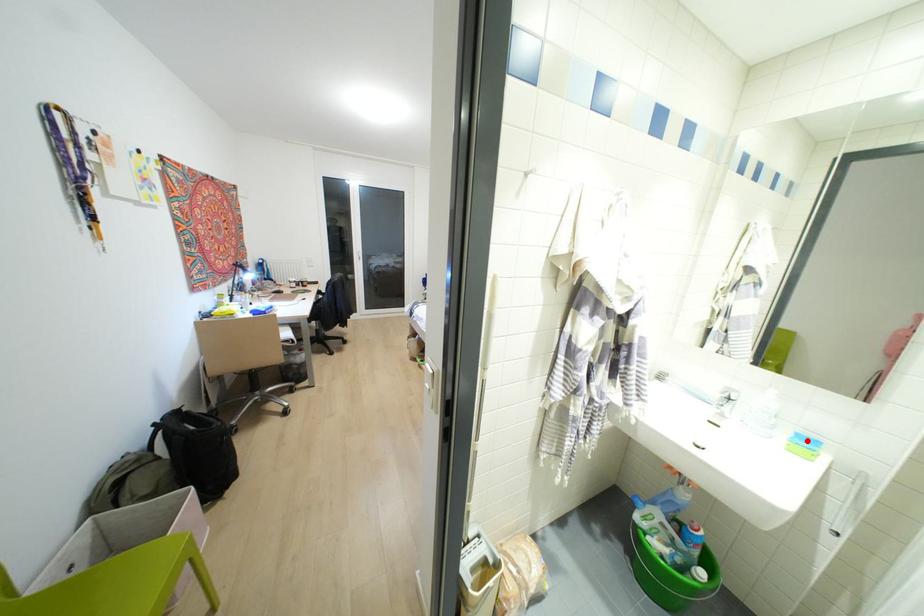
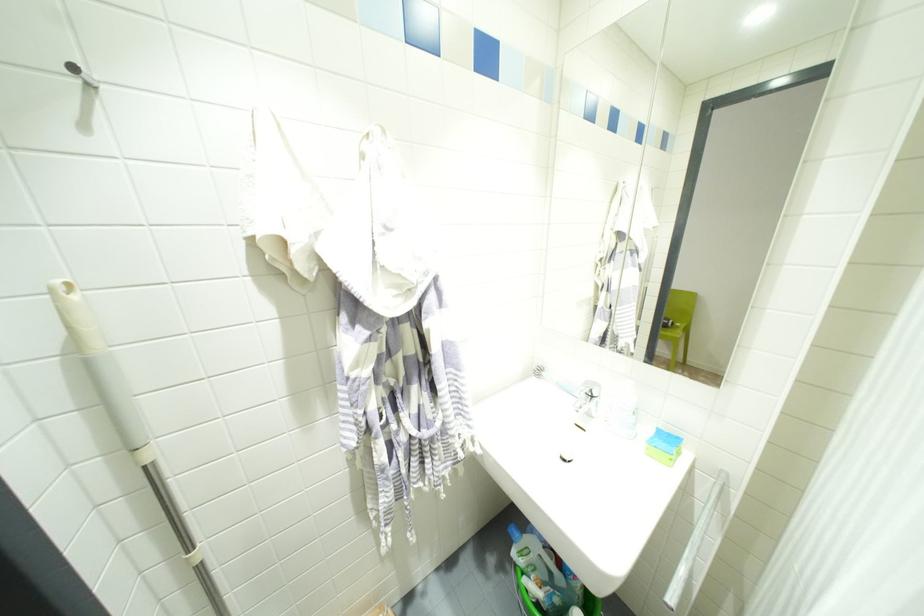
Locate, in the second image, the point that corresponds to the highlighted location in the first image.

(667, 439)